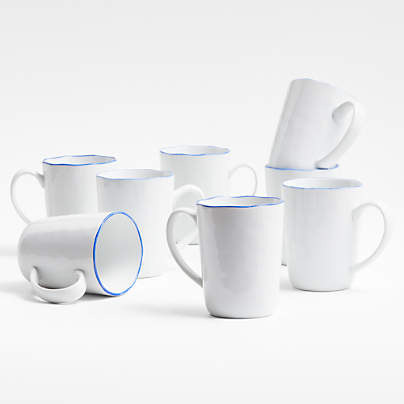
Where is `rims of mugs`? The height and width of the screenshot is (404, 404). rims of mugs is located at coordinates (319, 80), (316, 186), (209, 205), (193, 153), (113, 179), (52, 162), (114, 211).